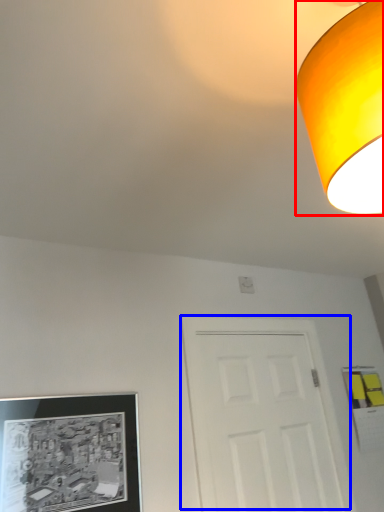
Question: Among these objects, which one is nearest to the camera, lamp (highlighted by a red box) or door (highlighted by a blue box)?

Choices:
 (A) lamp
 (B) door

Answer: (A)